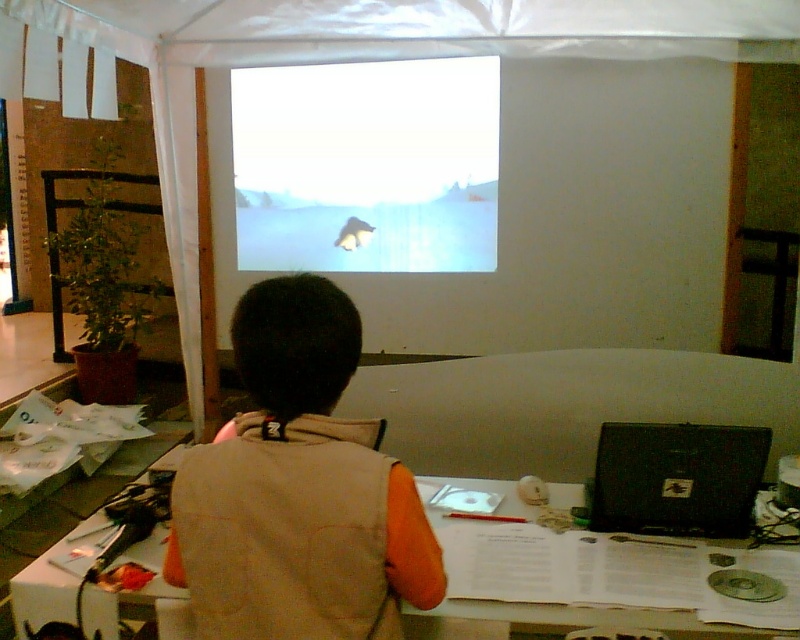
Question: Which of these objects is positioned closest to the orange fabric vest at center?

Choices:
 (A) white paper at center
 (B) white glossy screen at center

Answer: (A)

Question: Which is nearer to the orange fabric vest at center?

Choices:
 (A) white glossy screen at center
 (B) black matte laptop at right

Answer: (B)

Question: Which object is farther from the camera taking this photo?

Choices:
 (A) orange fabric vest at center
 (B) white paper at center
 (C) black matte laptop at right

Answer: (C)

Question: Is orange fabric vest at center wider than white paper at center?

Choices:
 (A) no
 (B) yes

Answer: (A)

Question: In this image, where is orange fabric vest at center located relative to white glossy screen at center?

Choices:
 (A) above
 (B) below

Answer: (B)

Question: Is orange fabric vest at center to the left of white glossy screen at center from the viewer's perspective?

Choices:
 (A) yes
 (B) no

Answer: (B)